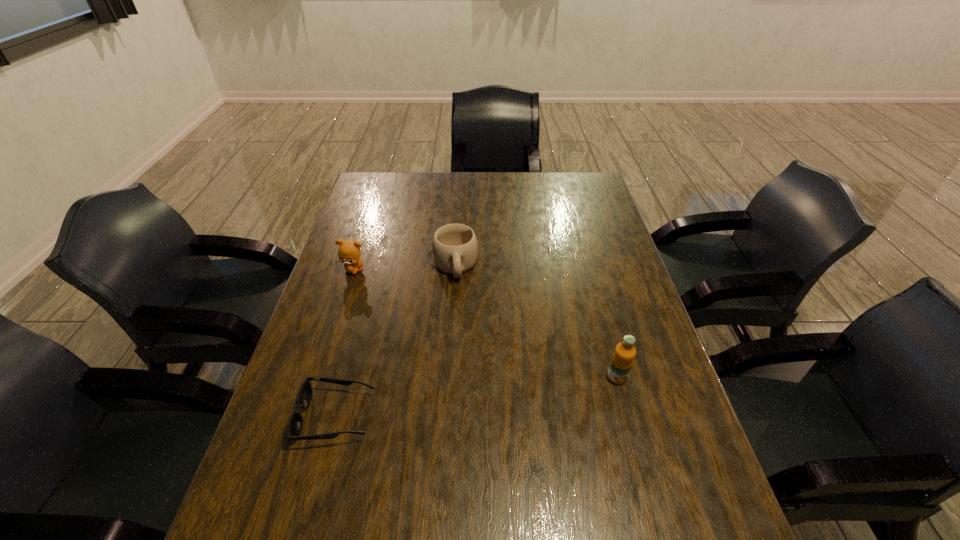
You are a GUI agent. You are given a task and a screenshot of the screen. Output one action in this format:
    pyautogui.click(x=<x>, y=<y>)
    Task: Click on the object that is the second closest to the third farthest object
    
    Given the screenshot: What is the action you would take?
    pyautogui.click(x=304, y=398)

This screenshot has width=960, height=540. Find the location of `the third closest object to the second object from right to left`. the third closest object to the second object from right to left is located at coordinates pyautogui.click(x=622, y=360).